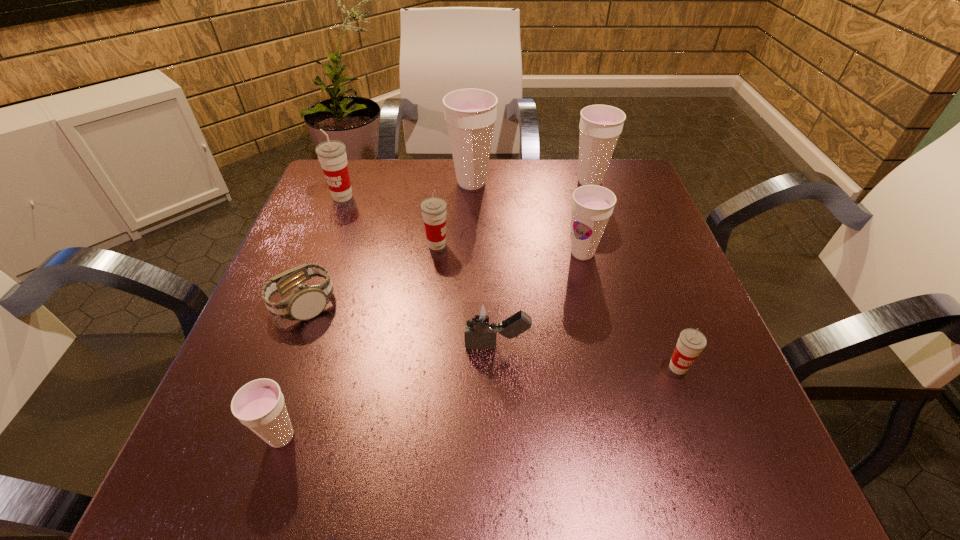
This screenshot has width=960, height=540. In order to click on vacant space located on the front of the gray igniter in this screenshot , I will do `click(501, 469)`.

Locate an element on the screen. The image size is (960, 540). vacant space located 0.110m on the side of the nearest red cup with the logo is located at coordinates (706, 443).

Where is `free spot located 0.260m on the right of the nearest object`? free spot located 0.260m on the right of the nearest object is located at coordinates (479, 437).

Locate an element on the screen. blank space located on the face of the sixth farthest object is located at coordinates (450, 303).

The height and width of the screenshot is (540, 960). I want to click on object located in the near edge section of the desktop, so [x=259, y=405].

Locate an element on the screen. watch that is at the left edge is located at coordinates (306, 301).

What are the coordinates of `object that is at the far left corner` in the screenshot? It's located at (332, 156).

Locate an element on the screen. This screenshot has width=960, height=540. object that is at the near left corner is located at coordinates (259, 405).

The image size is (960, 540). I want to click on object at the far right corner, so click(x=600, y=126).

Where is `vacant area at the far edge`? The height and width of the screenshot is (540, 960). vacant area at the far edge is located at coordinates (555, 161).